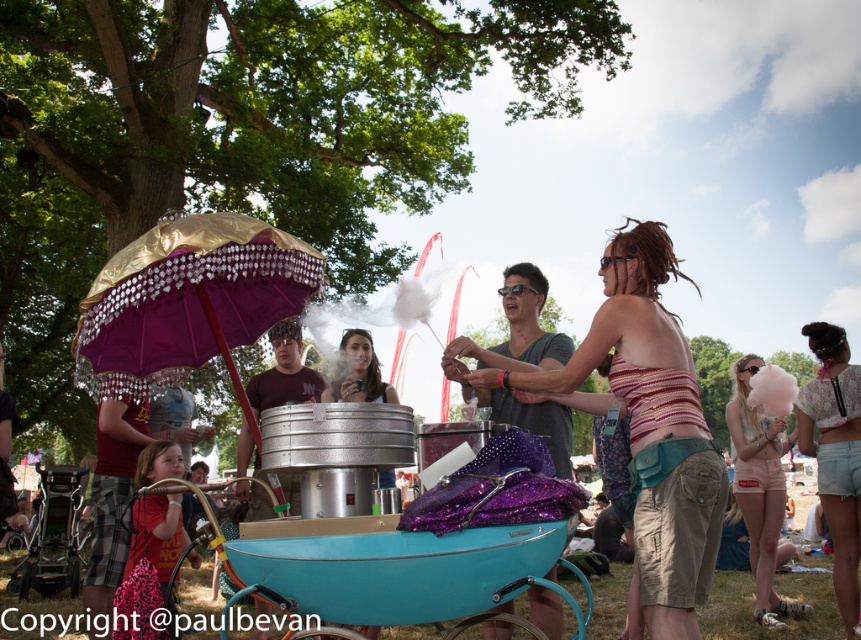
Does point (623, 227) come farther from viewer compared to point (847, 593)?

No.

Is striped fabric bikini top at center to the left of white lace top at right from the viewer's perspective?

Correct, you'll find striped fabric bikini top at center to the left of white lace top at right.

Where is `striped fabric bikini top at center`? This screenshot has width=861, height=640. striped fabric bikini top at center is located at coordinates (646, 426).

Find the location of a particular element. Image resolution: width=861 pixels, height=640 pixels. striped fabric bikini top at center is located at coordinates (646, 426).

Measure the distance from striped fabric bikini top at center to light pink denim shorts at lower right.

striped fabric bikini top at center is 4.02 meters away from light pink denim shorts at lower right.

Is point (632, 413) more distant than point (759, 442)?

No, (632, 413) is in front of (759, 442).

Who is more forward, (689,426) or (736,416)?

Point (689,426) is in front.

Image resolution: width=861 pixels, height=640 pixels. In order to click on striped fabric bikini top at center in this screenshot , I will do `click(646, 426)`.

Locate an element on the screen. white lace top at right is located at coordinates (835, 454).